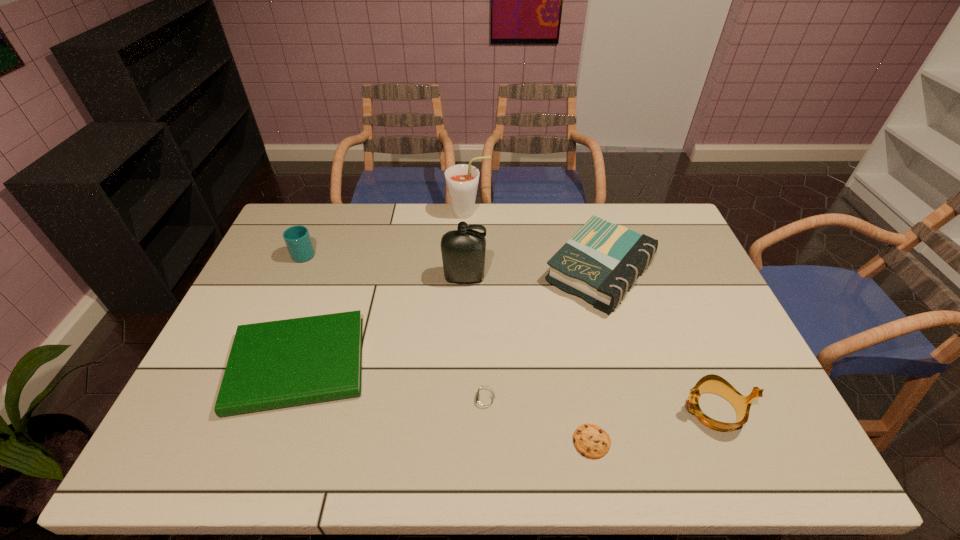
Identify the location of free location located 0.270m on the drink side of the root beer. This screenshot has height=540, width=960. (562, 213).

Identify the location of free space located 0.210m on the back of the bottle. This screenshot has height=540, width=960. (467, 228).

Where is `vacant region located 0.170m on the handle side of the cup`? vacant region located 0.170m on the handle side of the cup is located at coordinates (322, 214).

Locate an element on the screen. This screenshot has width=960, height=540. vacant area situated on the handle side of the cup is located at coordinates (314, 231).

Identify the location of free space located 0.150m on the handle side of the cup. The width and height of the screenshot is (960, 540). (320, 218).

I want to click on free spot located 0.090m on the left of the right paperback book, so click(516, 272).

You are a GUI agent. You are given a task and a screenshot of the screen. Output one action in this format:
    pyautogui.click(x=<x>, y=<y>)
    Task: Click on the vacant space located 0.360m at the front emblem of the tiara
    The image size is (960, 540).
    Given the screenshot: What is the action you would take?
    pyautogui.click(x=532, y=410)

The image size is (960, 540). In order to click on vacant space located at the front emblem of the tiara in this screenshot , I will do point(552,410).

This screenshot has height=540, width=960. In order to click on vacant region located 0.390m at the front emblem of the tiara in this screenshot , I will do `click(519, 410)`.

Locate an element on the screen. The width and height of the screenshot is (960, 540). vacant space located 0.170m on the right of the left paperback book is located at coordinates (432, 364).